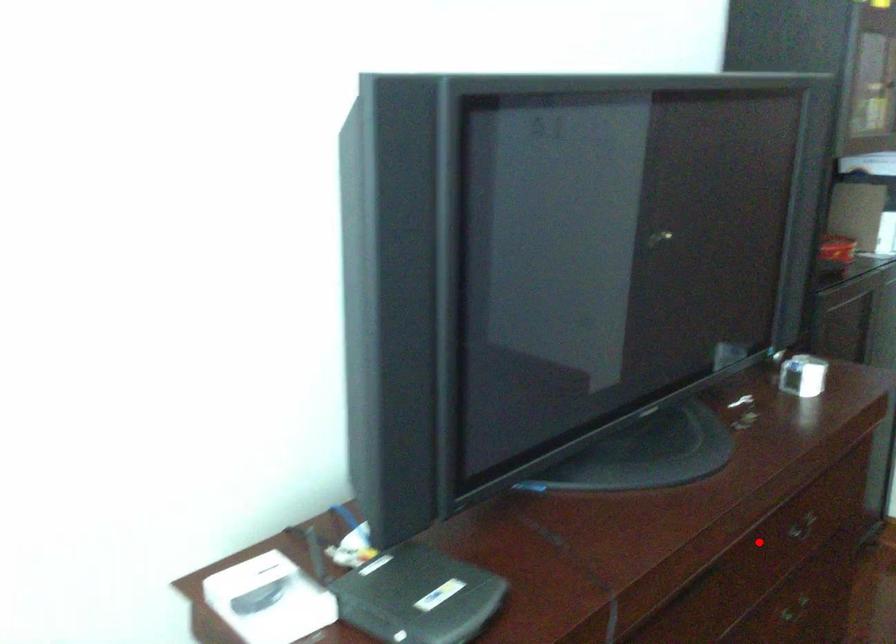
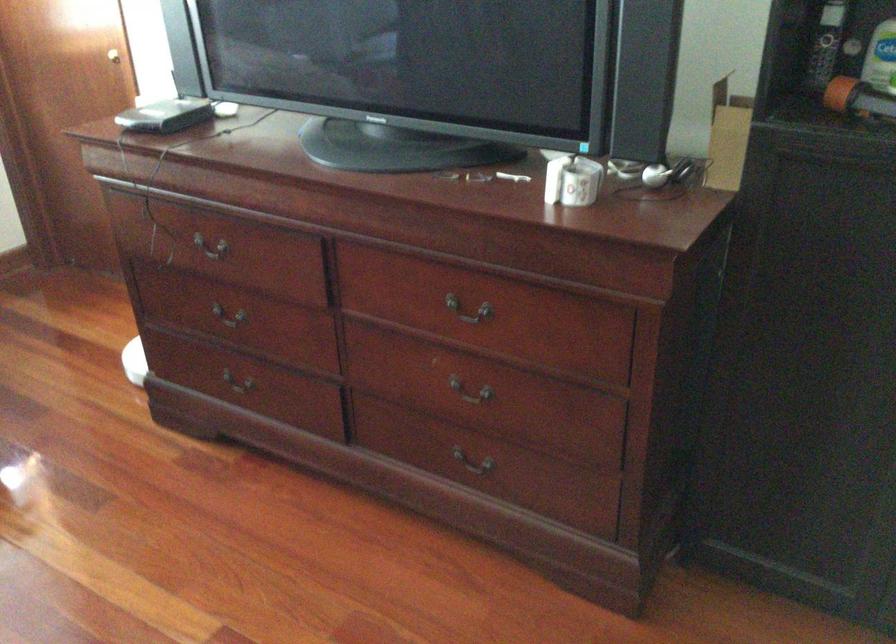
The point at the highlighted location is marked in the first image. Where is the corresponding point in the second image?

(469, 310)